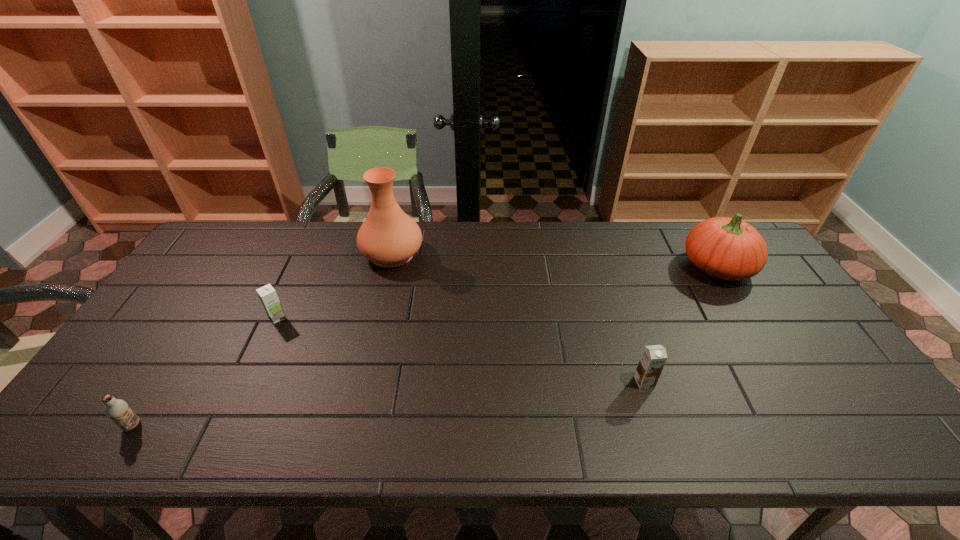
Locate an element on the screen. free spot between the second nearest chocolate milk and the farthest chocolate milk is located at coordinates (461, 350).

Find the location of `unoccupied area between the vase and the nearest object`. unoccupied area between the vase and the nearest object is located at coordinates (262, 340).

At what (x,y) coordinates should I click in order to perform the action: click on free space between the third object from right to left and the second nearest object. Please return your answer as a coordinate pair (x, y). Looking at the image, I should click on (518, 318).

Image resolution: width=960 pixels, height=540 pixels. I want to click on free area in between the vase and the leftmost object, so click(x=262, y=340).

This screenshot has width=960, height=540. Find the location of `unoccupied position between the farthest chocolate milk and the pumpkin`. unoccupied position between the farthest chocolate milk and the pumpkin is located at coordinates (497, 292).

Locate an element on the screen. This screenshot has width=960, height=540. free space between the rightmost chocolate milk and the pumpkin is located at coordinates (681, 324).

Find the location of a particular element. This screenshot has width=960, height=540. unoccupied position between the leftmost chocolate milk and the pumpkin is located at coordinates (425, 346).

Locate which object ranks third in proximity to the farthest chocolate milk. Please provide its 2D coordinates. Your answer should be formatted as a tuple, i.e. [(x, y)], where the tuple contains the x and y coordinates of a point satisfying the conditions above.

[(653, 358)]

Where is `the closest object to the nearest object`? Image resolution: width=960 pixels, height=540 pixels. the closest object to the nearest object is located at coordinates (268, 296).

The height and width of the screenshot is (540, 960). Identify the location of chocolate milk object that ranks as the second closest to the rightmost object. (268, 296).